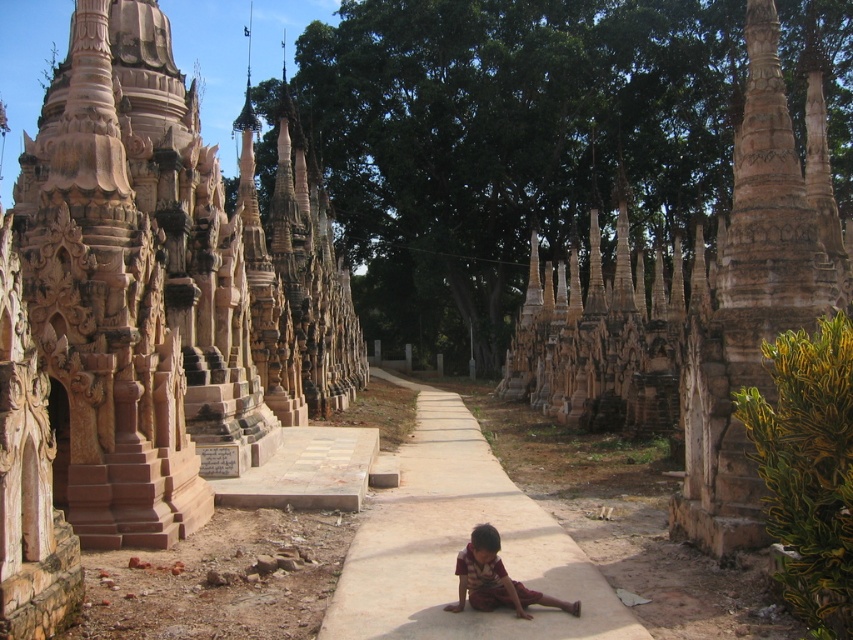
You are a visitor standing at the entrance of the temple complex. You see the brown stone temple at center and the brown fabric pants at center. Which object is positioned higher relative to the ground?

The brown stone temple at center is located above the brown fabric pants at center, so the brown stone temple at center is positioned higher relative to the ground.

You are a visitor standing at the entrance of the temple complex. You see the brown stone temple at center and the brown fabric pants at center. You want to visit both locations. Which one should you go to first if you want to minimize the total walking distance?

You should visit the brown stone temple at center first because it is closer to the entrance than the brown fabric pants at center, so going there first would minimize the total walking distance.

You are a tour guide leading a group through the temple complex. You notice the brown stone temple at center and the smooth stone pillar at center. Which of these two objects is narrower in width?

The brown stone temple at center is thinner than the smooth stone pillar at center, so the brown stone temple at center is narrower in width.